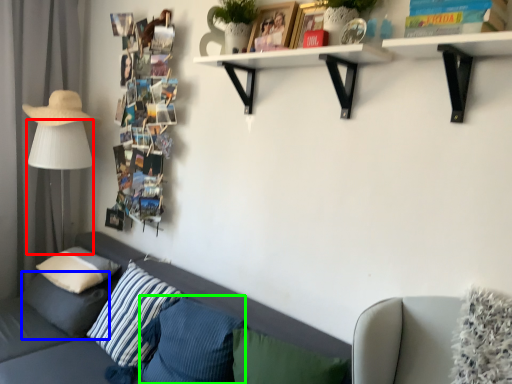
Question: Estimate the real-world distances between objects in this image. Which object is closer to table lamp (highlighted by a red box), pillow (highlighted by a blue box) or pillow (highlighted by a green box)?

Choices:
 (A) pillow
 (B) pillow

Answer: (A)